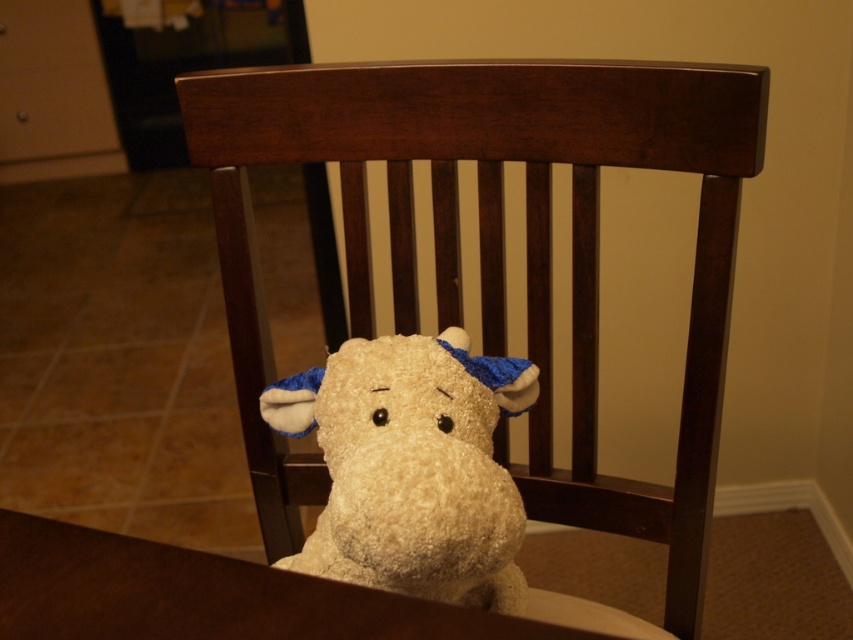
Is wooden rocking chair at center below fluffy white stuffed animal at center?

No.

Which is below, wooden rocking chair at center or fluffy white stuffed animal at center?

Positioned lower is fluffy white stuffed animal at center.

At what (x,y) coordinates should I click in order to perform the action: click on wooden rocking chair at center. Please return your answer as a coordinate pair (x, y). Looking at the image, I should click on (494, 250).

Is point (486, 426) farther from camera compared to point (73, 611)?

Yes, it is behind point (73, 611).

Is fluffy white stuffed animal at center taller than fluffy beige stuffed animal at center?

Indeed, fluffy white stuffed animal at center has a greater height compared to fluffy beige stuffed animal at center.

Where is `fluffy white stuffed animal at center`? fluffy white stuffed animal at center is located at coordinates (410, 467).

Is wooden rocking chair at center closer to camera compared to fluffy beige stuffed animal at center?

No, it is not.

In the scene shown: Who is more forward, (624, 161) or (517, 632)?

Positioned in front is point (517, 632).

The height and width of the screenshot is (640, 853). In order to click on wooden rocking chair at center in this screenshot , I will do `click(494, 250)`.